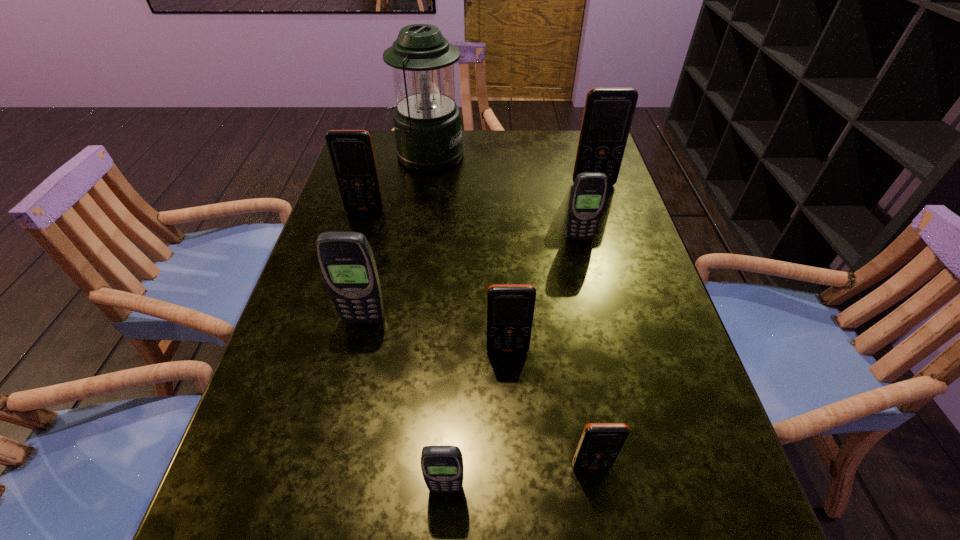
Where is `vacant area that lies between the third biggest orange cellular telephone and the rightmost gray cellular telephone`? This screenshot has height=540, width=960. vacant area that lies between the third biggest orange cellular telephone and the rightmost gray cellular telephone is located at coordinates (543, 294).

I want to click on blank region between the farthest object and the third orange cellular telephone from right to left, so click(468, 253).

Find the location of a particular element. This screenshot has width=960, height=540. free space between the third farthest cellular telephone and the second farthest gray cellular telephone is located at coordinates (471, 279).

This screenshot has height=540, width=960. In order to click on free space that is in between the leftmost orange cellular telephone and the rightmost orange cellular telephone in this screenshot , I will do `click(479, 197)`.

Where is `free space between the fourth nearest object and the sixth farthest cellular telephone`? The width and height of the screenshot is (960, 540). free space between the fourth nearest object and the sixth farthest cellular telephone is located at coordinates (477, 393).

I want to click on vacant area between the second biggest orange cellular telephone and the fifth nearest cellular telephone, so click(472, 224).

Identify which object is located as the seventh nearest to the fifth farthest cellular telephone. Please provide its 2D coordinates. Your answer should be formatted as a tuple, i.e. [(x, y)], where the tuple contains the x and y coordinates of a point satisfying the conditions above.

[(427, 122)]

Select which object appears as the fourth closest to the seventh farthest object. Please provide its 2D coordinates. Your answer should be formatted as a tuple, i.e. [(x, y)], where the tuple contains the x and y coordinates of a point satisfying the conditions above.

[(589, 191)]

Find the location of a particular element. cellular telephone that stands as the third closest to the third orange cellular telephone from left to right is located at coordinates pyautogui.click(x=346, y=260).

Where is `cellular telephone that is the sixth nearest to the nearest orange cellular telephone`? The width and height of the screenshot is (960, 540). cellular telephone that is the sixth nearest to the nearest orange cellular telephone is located at coordinates coord(608,113).